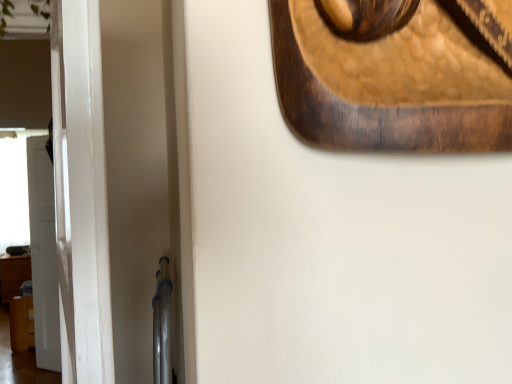
What do you see at coordinates (42, 254) in the screenshot?
I see `white glossy door at left` at bounding box center [42, 254].

The width and height of the screenshot is (512, 384). Identify the location of white glossy door at left. (42, 254).

The height and width of the screenshot is (384, 512). I want to click on white glossy door at left, so point(42,254).